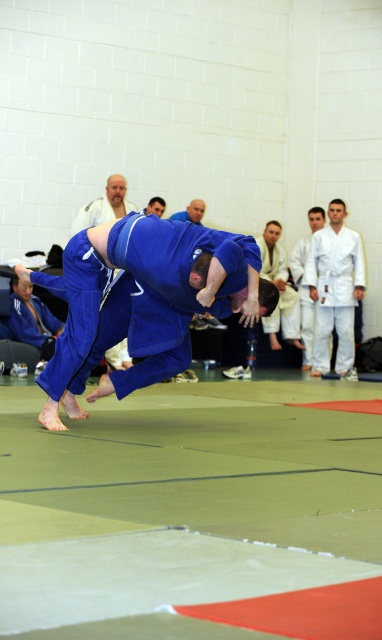
Does blue fabric kimono at lower left come in front of white/textured kimono at center?

Yes.

Which is above, blue fabric kimono at lower left or white/textured kimono at center?

white/textured kimono at center is higher up.

Is point (43, 349) less distant than point (307, 244)?

Yes.

Find the location of a particular element. The height and width of the screenshot is (640, 382). blue fabric kimono at lower left is located at coordinates (32, 320).

Describe the element at coordinates (335, 289) in the screenshot. I see `white karate uniform at upper right` at that location.

Does white karate uniform at upper right come behind blue fabric kimono at lower left?

That is True.

What are the coordinates of `white karate uniform at upper right` in the screenshot? It's located at (335, 289).

What are the coordinates of `white karate uniform at upper right` in the screenshot? It's located at (335, 289).

Locate an element on the screen. white karate uniform at upper right is located at coordinates (335, 289).

Does point (328, 333) lie behind point (121, 196)?

Yes.

Who is more forward, (x=309, y=276) or (x=77, y=214)?

Point (x=77, y=214)

At what (x,y) coordinates should I click in order to perform the action: click on white karate uniform at upper right. Please return your answer as a coordinate pair (x, y). Looking at the image, I should click on (335, 289).